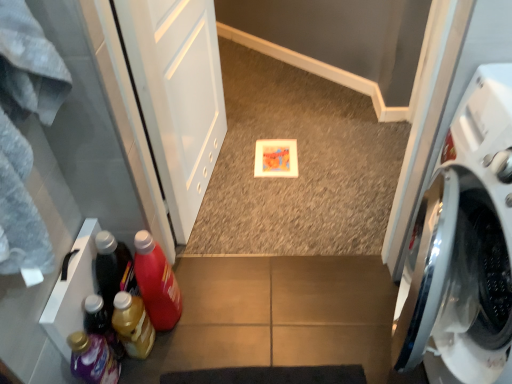
Where is `unoccupied space behind white glossy screen door at upper left`? unoccupied space behind white glossy screen door at upper left is located at coordinates (255, 125).